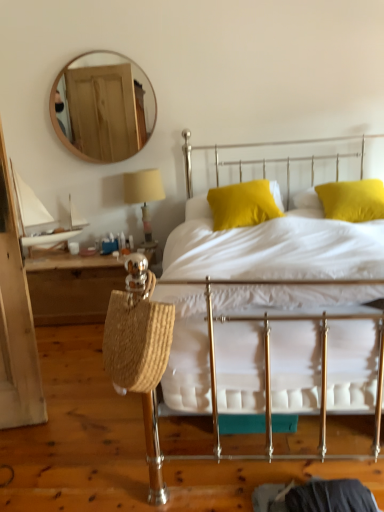
What do you see at coordinates (242, 204) in the screenshot?
I see `yellow fabric pillow at center, which is counted as the 2th pillow, starting from the right` at bounding box center [242, 204].

What is the approximate width of white cotton bed at center?

It is 2.23 meters.

What do you see at coordinates (257, 281) in the screenshot? I see `white cotton bed at center` at bounding box center [257, 281].

Image resolution: width=384 pixels, height=512 pixels. What do you see at coordinates (353, 200) in the screenshot? I see `matte yellow pillow at upper right, which is the 2th pillow in left-to-right order` at bounding box center [353, 200].

Where is `woven straw bag at left`? woven straw bag at left is located at coordinates (73, 287).

How different are the orientations of woven straw bag at left and beige fabric lampshade at upper center in degrees?

1.03 degrees separate the facing orientations of woven straw bag at left and beige fabric lampshade at upper center.

In the scene shown: Are woven straw bag at left and beige fabric lampshade at upper center located far from each other?

woven straw bag at left is near beige fabric lampshade at upper center, not far away.

From a real-world perspective, is woven straw bag at left positioned above or below beige fabric lampshade at upper center?

woven straw bag at left is below beige fabric lampshade at upper center.

Can you confirm if woven straw bag at left is positioned to the left of beige fabric lampshade at upper center?

Yes, woven straw bag at left is to the left of beige fabric lampshade at upper center.

From the picture: Considering the sizes of objects yellow fabric pillow at center, which is counted as the 2th pillow, starting from the right, and white cotton bed at center in the image provided, who is shorter, yellow fabric pillow at center, which is counted as the 2th pillow, starting from the right, or white cotton bed at center?

With less height is yellow fabric pillow at center, which is counted as the 2th pillow, starting from the right.

Is yellow fabric pillow at center, which is counted as the 2th pillow, starting from the right, far away from white cotton bed at center?

No, yellow fabric pillow at center, which is counted as the 2th pillow, starting from the right, is not far away from white cotton bed at center.

Which is behind, yellow fabric pillow at center, which is counted as the 2th pillow, starting from the right, or white cotton bed at center?

Answer: yellow fabric pillow at center, which is counted as the 2th pillow, starting from the right, is more distant.

Is white cotton bed at center positioned beyond the bounds of matte yellow pillow at upper right, which is the 2th pillow in left-to-right order?

white cotton bed at center lies outside matte yellow pillow at upper right, which is the 2th pillow in left-to-right order,'s area.

From a real-world perspective, is white cotton bed at center located beneath matte yellow pillow at upper right, which is the 2th pillow in left-to-right order?

Correct, in the physical world, white cotton bed at center is lower than matte yellow pillow at upper right, which is the 2th pillow in left-to-right order.

Considering the positions of objects white cotton bed at center and matte yellow pillow at upper right, arranged as the 1th pillow when viewed from the right, in the image provided, who is behind, white cotton bed at center or matte yellow pillow at upper right, arranged as the 1th pillow when viewed from the right,?

matte yellow pillow at upper right, arranged as the 1th pillow when viewed from the right.

Is white cotton bed at center taller than matte yellow pillow at upper right, arranged as the 1th pillow when viewed from the right?

Indeed, white cotton bed at center has a greater height compared to matte yellow pillow at upper right, arranged as the 1th pillow when viewed from the right.

Can you confirm if white cotton bed at center is positioned to the left of yellow fabric pillow at center, which appears as the first pillow when viewed from the left?

No.

Do you think white cotton bed at center is within yellow fabric pillow at center, which is counted as the 2th pillow, starting from the right, or outside of it?

white cotton bed at center is not enclosed by yellow fabric pillow at center, which is counted as the 2th pillow, starting from the right.

Is yellow fabric pillow at center, which appears as the first pillow when viewed from the left, positioned with its back to woven straw bag at left?

That's not correct — yellow fabric pillow at center, which appears as the first pillow when viewed from the left, is not looking away from woven straw bag at left.

From the image's perspective, is yellow fabric pillow at center, which is counted as the 2th pillow, starting from the right, located above or below woven straw bag at left?

yellow fabric pillow at center, which is counted as the 2th pillow, starting from the right, is situated higher than woven straw bag at left in the image.

Is yellow fabric pillow at center, which is counted as the 2th pillow, starting from the right, to the left of woven straw bag at left from the viewer's perspective?

In fact, yellow fabric pillow at center, which is counted as the 2th pillow, starting from the right, is to the right of woven straw bag at left.

Identify the location of the 1st pillow to the right of the woven straw bag at left, starting your count from the anchor. The image size is (384, 512). (242, 204).

Considering the positions of objects beige fabric lampshade at upper center and white cotton bed at center in the image provided, who is more to the right, beige fabric lampshade at upper center or white cotton bed at center?

From the viewer's perspective, white cotton bed at center appears more on the right side.

I want to click on bed on the right of beige fabric lampshade at upper center, so click(257, 281).

Relative to white cotton bed at center, is beige fabric lampshade at upper center in front or behind?

beige fabric lampshade at upper center is positioned farther from the viewer than white cotton bed at center.

Is matte yellow pillow at upper right, which is the 2th pillow in left-to-right order, positioned beyond the bounds of white cotton bed at center?

Actually, matte yellow pillow at upper right, which is the 2th pillow in left-to-right order, is within white cotton bed at center.

The image size is (384, 512). What are the coordinates of `bed below the matte yellow pillow at upper right, which is the 2th pillow in left-to-right order (from a real-world perspective)` in the screenshot? It's located at (257, 281).

Could you tell me if matte yellow pillow at upper right, arranged as the 1th pillow when viewed from the right, is facing white cotton bed at center?

Yes, matte yellow pillow at upper right, arranged as the 1th pillow when viewed from the right, is facing white cotton bed at center.

Consider the image. In terms of width, does matte yellow pillow at upper right, arranged as the 1th pillow when viewed from the right, look wider or thinner when compared to white cotton bed at center?

matte yellow pillow at upper right, arranged as the 1th pillow when viewed from the right, is thinner than white cotton bed at center.

Image resolution: width=384 pixels, height=512 pixels. I want to click on nightstand lying in front of the beige fabric lampshade at upper center, so click(x=73, y=287).

There is a white cotton bed at center. Identify the location of the 2nd pillow above it (from a real-world perspective). (242, 204).

Estimate the real-world distances between objects in this image. Which object is closer to woven straw bag at left, beige fabric lampshade at upper center or yellow fabric pillow at center, which is counted as the 2th pillow, starting from the right?

Among the two, beige fabric lampshade at upper center is located nearer to woven straw bag at left.

Estimate the real-world distances between objects in this image. Which object is further from woven straw bag at left, wooden round mirror at upper left or white cotton bed at center?

The object further to woven straw bag at left is white cotton bed at center.

When comparing their distances from yellow fabric pillow at center, which is counted as the 2th pillow, starting from the right, does matte yellow pillow at upper right, which is the 2th pillow in left-to-right order, or beige fabric lampshade at upper center seem further?

Among the two, beige fabric lampshade at upper center is located further to yellow fabric pillow at center, which is counted as the 2th pillow, starting from the right.

In the scene shown: Considering their positions, is yellow fabric pillow at center, which appears as the first pillow when viewed from the left, positioned further to white cotton bed at center than matte yellow pillow at upper right, arranged as the 1th pillow when viewed from the right?

matte yellow pillow at upper right, arranged as the 1th pillow when viewed from the right, is positioned further to the anchor white cotton bed at center.

When comparing their distances from woven straw bag at left, does matte yellow pillow at upper right, arranged as the 1th pillow when viewed from the right, or beige fabric lampshade at upper center seem closer?

beige fabric lampshade at upper center is positioned closer to the anchor woven straw bag at left.

From the image, which object appears to be farther from yellow fabric pillow at center, which is counted as the 2th pillow, starting from the right, woven straw bag at left or matte yellow pillow at upper right, which is the 2th pillow in left-to-right order?

Among the two, woven straw bag at left is located further to yellow fabric pillow at center, which is counted as the 2th pillow, starting from the right.

Based on their spatial positions, is yellow fabric pillow at center, which appears as the first pillow when viewed from the left, or matte yellow pillow at upper right, which is the 2th pillow in left-to-right order, closer to wooden round mirror at upper left?

The object closer to wooden round mirror at upper left is yellow fabric pillow at center, which appears as the first pillow when viewed from the left.

Which object lies nearer to the anchor point beige fabric lampshade at upper center, yellow fabric pillow at center, which appears as the first pillow when viewed from the left, or wooden round mirror at upper left?

Based on the image, wooden round mirror at upper left appears to be nearer to beige fabric lampshade at upper center.

Identify the location of table lamp located between woven straw bag at left and yellow fabric pillow at center, which is counted as the 2th pillow, starting from the right, in the left-right direction. The width and height of the screenshot is (384, 512). (144, 195).

Identify the location of mirror between woven straw bag at left and matte yellow pillow at upper right, which is the 2th pillow in left-to-right order. (103, 106).

You are a GUI agent. You are given a task and a screenshot of the screen. Output one action in this format:
    pyautogui.click(x=<x>, y=<y>)
    Task: Click on the nightstand positioned between white cotton bed at center and wooden round mirror at upper left from near to far
    The height and width of the screenshot is (512, 384).
    Given the screenshot: What is the action you would take?
    pyautogui.click(x=73, y=287)

The width and height of the screenshot is (384, 512). What are the coordinates of `pillow located between wooden round mirror at upper left and matte yellow pillow at upper right, which is the 2th pillow in left-to-right order, in the left-right direction` in the screenshot? It's located at (242, 204).